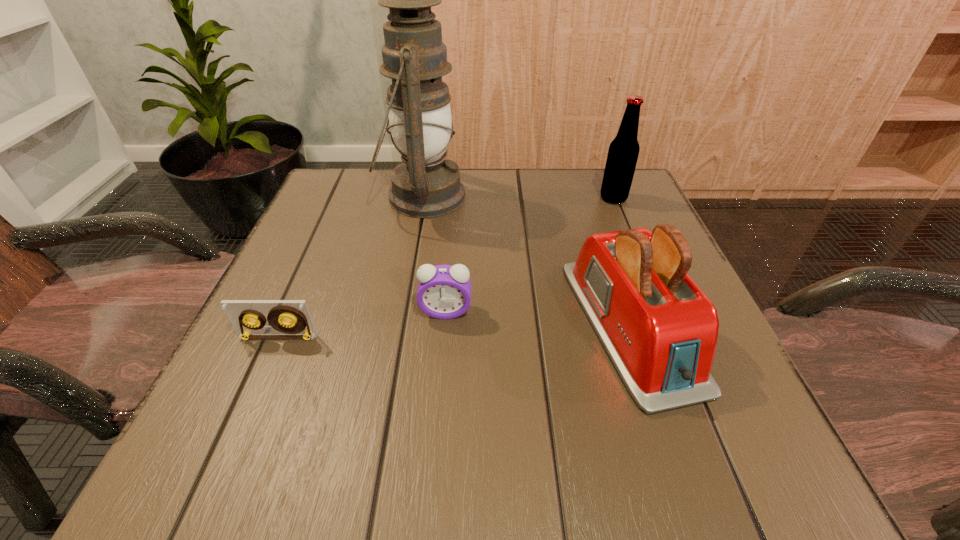
You are a GUI agent. You are given a task and a screenshot of the screen. Output one action in this format:
    pyautogui.click(x=<x>, y=<y>)
    Task: Click on the oil lamp
    This screenshot has height=540, width=960.
    Given the screenshot: What is the action you would take?
    pyautogui.click(x=425, y=185)

Locate an element on the screen. The height and width of the screenshot is (540, 960). beer bottle is located at coordinates (623, 152).

Locate an element on the screen. toaster is located at coordinates (660, 330).

You are a GUI agent. You are given a task and a screenshot of the screen. Output one action in this format:
    pyautogui.click(x=<x>, y=<y>)
    Task: Click on the alarm clock
    This screenshot has width=960, height=540.
    Given the screenshot: What is the action you would take?
    pyautogui.click(x=444, y=291)

Identify the location of the leftmost object. The height and width of the screenshot is (540, 960). (240, 312).

Locate an element on the screen. videotape is located at coordinates (240, 312).

Where is `vacant position located on the right of the tallest object`? The image size is (960, 540). vacant position located on the right of the tallest object is located at coordinates (620, 197).

This screenshot has width=960, height=540. What are the coordinates of `free space located 0.240m on the front of the second tallest object` in the screenshot? It's located at (646, 276).

Identify the location of vacant region located 0.180m on the left of the third shortest object. Image resolution: width=960 pixels, height=540 pixels. (466, 325).

Locate an element on the screen. This screenshot has height=540, width=960. blank space located on the face of the second shortest object is located at coordinates (432, 482).